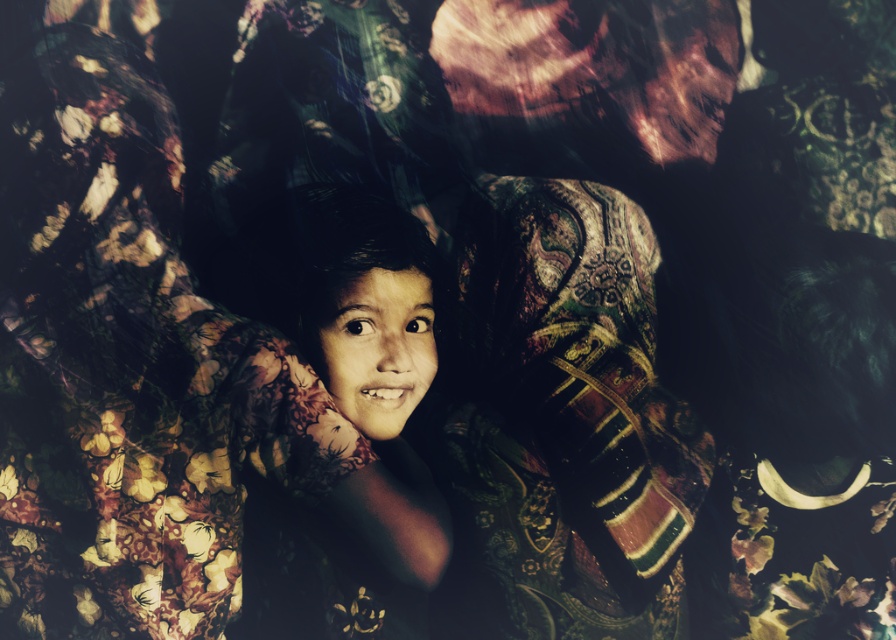
You are a photographer standing 1.5 meters away from the camera. You want to adjust the focus to capture the richly embroidered fabric at center clearly. Can you reach the fabric to adjust the focus without moving closer?

The richly embroidered fabric at center is 1.44 meters from viewer. Since you are standing 1.5 meters away from the camera, you are 0.06 meters farther than the fabric. Therefore, you can reach it without moving closer.

You are taking a photo of the child and need to adjust the lighting to ensure the richly embroidered fabric at center is properly illuminated. Based on the current setup, where is the light source positioned relative to the fabric?

The light source is positioned above and to the left of the richly embroidered fabric at center because the shadows cast across the child and fabric suggest the light is coming from that direction.

You are a photographer trying to capture a closeup of the child in the image. Given that the richly embroidered fabric at center and the smooth skin child at center are both in the frame, which object will occupy more of the photo? Please explain based on their sizes.

The richly embroidered fabric at center is bigger than the smooth skin child at center, so it will occupy more space in the photo.